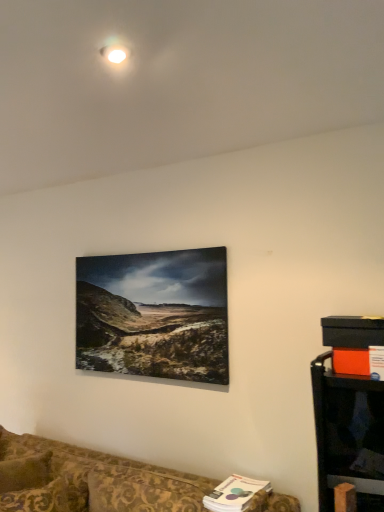
Where is `patterned fabric couch at lower left`? The image size is (384, 512). patterned fabric couch at lower left is located at coordinates (90, 480).

Describe the element at coordinates (90, 480) in the screenshot. I see `patterned fabric couch at lower left` at that location.

Describe the element at coordinates (349, 412) in the screenshot. I see `black plastic entertainment center at lower right` at that location.

You are a GUI agent. You are given a task and a screenshot of the screen. Output one action in this format:
    pyautogui.click(x=<x>, y=<y>)
    Task: Click on the black plastic entertainment center at lower right
    The image size is (384, 512).
    Given the screenshot: What is the action you would take?
    pyautogui.click(x=349, y=412)

You are a GUI agent. You are given a task and a screenshot of the screen. Output one action in this format:
    pyautogui.click(x=<x>, y=<y>)
    Task: Click on the patterned fabric couch at lower left
    
    Given the screenshot: What is the action you would take?
    pyautogui.click(x=90, y=480)

Between patterned fabric couch at lower left and black plastic entertainment center at lower right, which one appears on the left side from the viewer's perspective?

patterned fabric couch at lower left is more to the left.

Is patterned fabric couch at lower left positioned in front of black plastic entertainment center at lower right?

Yes.

Considering the positions of point (170, 472) and point (378, 509), is point (170, 472) closer or farther from the camera than point (378, 509)?

Point (170, 472).

From the image's perspective, does patterned fabric couch at lower left appear lower than black plastic entertainment center at lower right?

Yes.

From a real-world perspective, which is physically below, patterned fabric couch at lower left or black plastic entertainment center at lower right?

patterned fabric couch at lower left is physically lower.

Considering the relative sizes of patterned fabric couch at lower left and black plastic entertainment center at lower right in the image provided, is patterned fabric couch at lower left thinner than black plastic entertainment center at lower right?

No, patterned fabric couch at lower left is not thinner than black plastic entertainment center at lower right.

Which of these two, patterned fabric couch at lower left or black plastic entertainment center at lower right, stands taller?

Standing taller between the two is patterned fabric couch at lower left.

Considering the sizes of objects patterned fabric couch at lower left and black plastic entertainment center at lower right in the image provided, who is bigger, patterned fabric couch at lower left or black plastic entertainment center at lower right?

patterned fabric couch at lower left.

Based on the photo, would you say patterned fabric couch at lower left is inside or outside black plastic entertainment center at lower right?

patterned fabric couch at lower left is outside black plastic entertainment center at lower right.

Is patterned fabric couch at lower left next to black plastic entertainment center at lower right?

They are not placed beside each other.

Could you tell me if patterned fabric couch at lower left is turned towards black plastic entertainment center at lower right?

No, patterned fabric couch at lower left is not turned towards black plastic entertainment center at lower right.

How many degrees apart are the facing directions of patterned fabric couch at lower left and black plastic entertainment center at lower right?

patterned fabric couch at lower left and black plastic entertainment center at lower right are facing 11.2 degrees away from each other.

This screenshot has height=512, width=384. I want to click on entertainment center above the patterned fabric couch at lower left (from a real-world perspective), so click(x=349, y=412).

Considering the relative positions of black plastic entertainment center at lower right and patterned fabric couch at lower left in the image provided, is black plastic entertainment center at lower right to the right of patterned fabric couch at lower left from the viewer's perspective?

Correct, you'll find black plastic entertainment center at lower right to the right of patterned fabric couch at lower left.

Is black plastic entertainment center at lower right further to the viewer compared to patterned fabric couch at lower left?

Yes.

Considering the points (376, 337) and (186, 508), which point is behind, point (376, 337) or point (186, 508)?

Positioned behind is point (186, 508).

From the picture: From the image's perspective, is black plastic entertainment center at lower right positioned above or below patterned fabric couch at lower left?

From the image's perspective, black plastic entertainment center at lower right appears above patterned fabric couch at lower left.

From a real-world perspective, between black plastic entertainment center at lower right and patterned fabric couch at lower left, who is vertically lower?

patterned fabric couch at lower left.

Between black plastic entertainment center at lower right and patterned fabric couch at lower left, which one has larger width?

patterned fabric couch at lower left is wider.

Considering the relative sizes of black plastic entertainment center at lower right and patterned fabric couch at lower left in the image provided, is black plastic entertainment center at lower right shorter than patterned fabric couch at lower left?

Yes.

Which of these two, black plastic entertainment center at lower right or patterned fabric couch at lower left, is bigger?

Bigger between the two is patterned fabric couch at lower left.

Is black plastic entertainment center at lower right completely or partially outside of patterned fabric couch at lower left?

Yes, black plastic entertainment center at lower right is not within patterned fabric couch at lower left.

Is black plastic entertainment center at lower right far from patterned fabric couch at lower left?

Actually, black plastic entertainment center at lower right and patterned fabric couch at lower left are a little close together.

Is black plastic entertainment center at lower right facing away from patterned fabric couch at lower left?

No.

You are a GUI agent. You are given a task and a screenshot of the screen. Output one action in this format:
    pyautogui.click(x=<x>, y=<y>)
    Task: Click on the entertainment center above the patterned fabric couch at lower left (from a real-world perspective)
    
    Given the screenshot: What is the action you would take?
    pyautogui.click(x=349, y=412)

Image resolution: width=384 pixels, height=512 pixels. I want to click on entertainment center above the patterned fabric couch at lower left (from the image's perspective), so click(x=349, y=412).

Locate an element on the screen. The image size is (384, 512). entertainment center lying behind the patterned fabric couch at lower left is located at coordinates (349, 412).